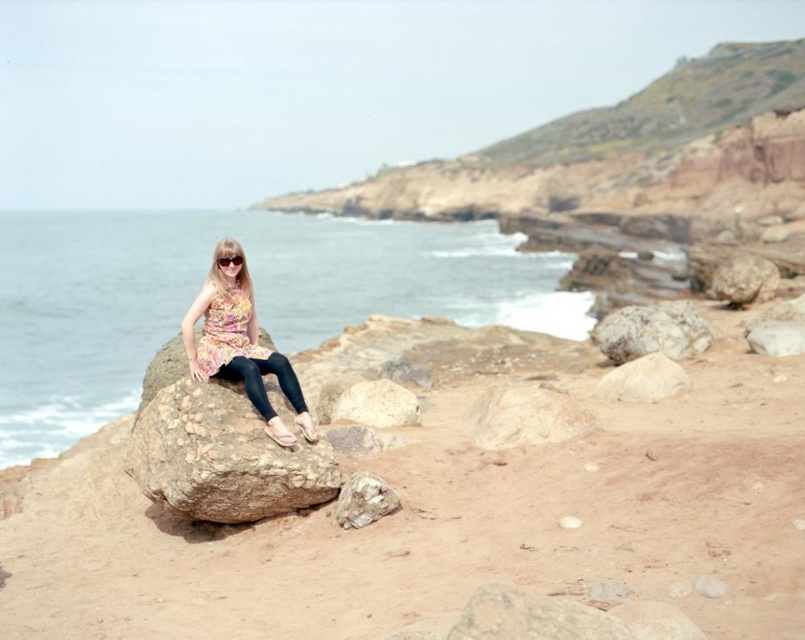
Question: Among these points, which one is farthest from the camera?

Choices:
 (A) (221, 534)
 (B) (354, 413)

Answer: (B)

Question: From the image, what is the correct spatial relationship of clear blue water at center in relation to brown rough rock at center?

Choices:
 (A) below
 (B) above

Answer: (B)

Question: Which point appears closest to the camera in this image?

Choices:
 (A) (391, 417)
 (B) (671, 346)
 (C) (376, 477)
 (D) (279, 314)

Answer: (C)

Question: Is white smooth rock at center closer to the viewer compared to black plastic sunglasses at center?

Choices:
 (A) yes
 (B) no

Answer: (B)

Question: Observing the image, what is the correct spatial positioning of brown rough rock at center in reference to black plastic sunglasses at center?

Choices:
 (A) below
 (B) above

Answer: (A)

Question: Which is farther from the black plastic sunglasses at center?

Choices:
 (A) brown rough rock at center
 (B) clear blue water at center
 (C) white smooth rock at center
 (D) smooth beige rock at center

Answer: (B)